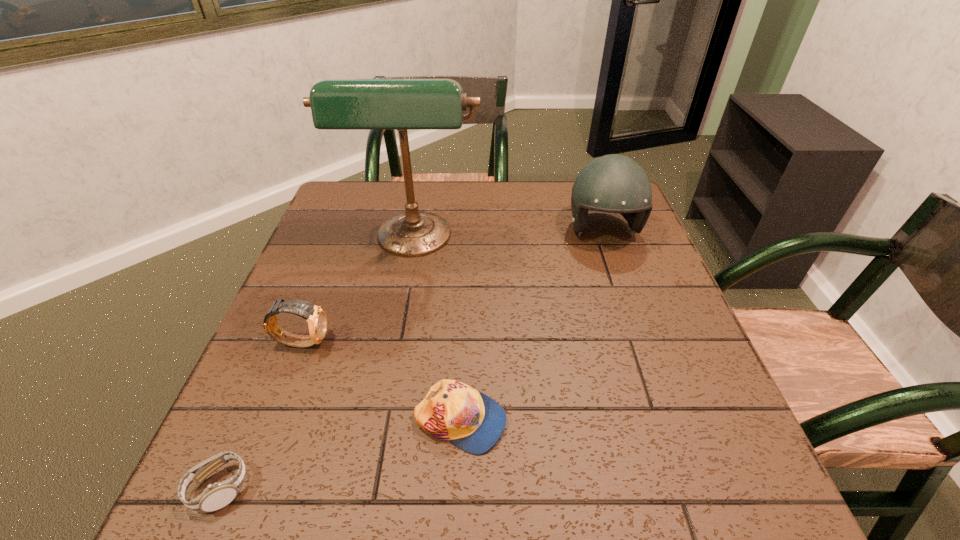
At what (x,y) coordinates should I click in order to perform the action: click on blank space located 0.250m on the face of the taller watch. Please return your answer as a coordinate pair (x, y). Looking at the image, I should click on (446, 342).

This screenshot has width=960, height=540. I want to click on free region located 0.390m on the bill of the cap, so click(721, 421).

You are a GUI agent. You are given a task and a screenshot of the screen. Output one action in this format:
    pyautogui.click(x=<x>, y=<y>)
    Task: Click on the vacant point located 0.280m on the face of the shortest object
    The image size is (960, 540).
    Given the screenshot: What is the action you would take?
    pyautogui.click(x=420, y=489)

You are a GUI agent. You are given a task and a screenshot of the screen. Output one action in this format:
    pyautogui.click(x=<x>, y=<y>)
    Task: Click on the table lamp positioned at the far edge
    This screenshot has height=540, width=960.
    Given the screenshot: What is the action you would take?
    pyautogui.click(x=338, y=104)

Find the location of a particular element. Image resolution: width=960 pixels, height=540 pixels. football helmet positioned at the far edge is located at coordinates point(613,183).

Image resolution: width=960 pixels, height=540 pixels. I want to click on object that is at the near edge, so click(x=216, y=496).

This screenshot has height=540, width=960. I want to click on table lamp located at the left edge, so click(338, 104).

Find the location of a particular element. The height and width of the screenshot is (540, 960). object that is at the right edge is located at coordinates coord(613,183).

This screenshot has height=540, width=960. I want to click on object located at the far left corner, so click(338, 104).

This screenshot has width=960, height=540. Identify the location of object that is at the near left corner. (216, 496).